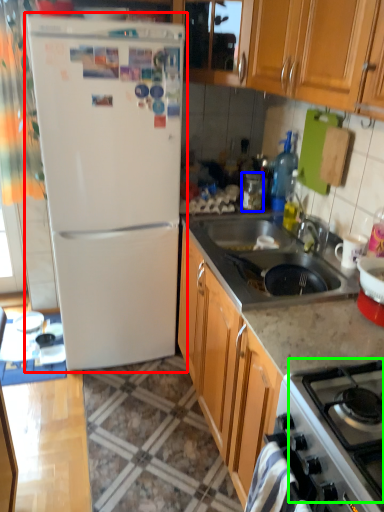
Question: Considering the real-world distances, which object is closest to refrigerator (highlighted by a red box)? appliance (highlighted by a blue box) or gas stove (highlighted by a green box).

Choices:
 (A) appliance
 (B) gas stove

Answer: (A)